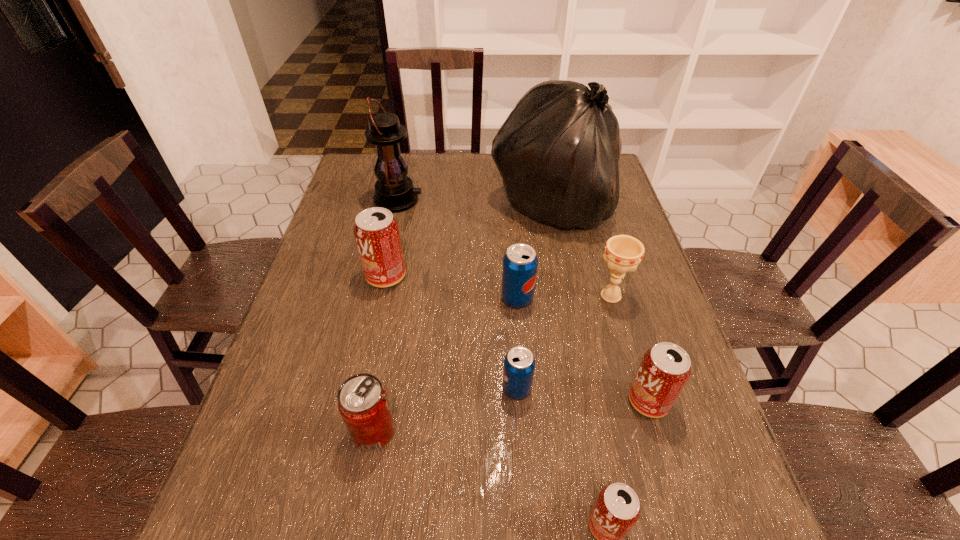
This screenshot has height=540, width=960. What are the coordinates of `unoccupied area between the chalice and the biggest red soda can` in the screenshot? It's located at (498, 286).

Identify the location of vacant space that's between the rightmost red soda can and the chalice. The height and width of the screenshot is (540, 960). (630, 348).

Locate an element on the screen. This screenshot has width=960, height=540. vacant area that lies between the bigger blue pop soda and the chalice is located at coordinates (564, 297).

You are a GUI agent. You are given a task and a screenshot of the screen. Output one action in this format:
    pyautogui.click(x=<x>, y=<y>)
    Task: Click on the free space that is in between the rightmost red soda can and the bigger blue pop soda
    
    Given the screenshot: What is the action you would take?
    pyautogui.click(x=583, y=349)

Find the location of a particular element. vacant area that lies between the rightmost soda can and the farther blue pop soda is located at coordinates (583, 349).

This screenshot has width=960, height=540. What are the coordinates of `empty space between the chalice and the tallest object` in the screenshot? It's located at (582, 250).

Locate which object is the closest to the bigger blue pop soda. Please provide its 2D coordinates. Your answer should be formatted as a tuple, i.e. [(x, y)], where the tuple contains the x and y coordinates of a point satisfying the conditions above.

[(623, 253)]

At what (x,y) coordinates should I click in order to perform the action: click on the fourth closest object to the farther blue pop soda. Please return your answer as a coordinate pair (x, y). This screenshot has width=960, height=540. Looking at the image, I should click on (376, 231).

Select which soda can appears as the fifth closest to the rightmost soda can. Please provide its 2D coordinates. Your answer should be formatted as a tuple, i.e. [(x, y)], where the tuple contains the x and y coordinates of a point satisfying the conditions above.

[(376, 231)]

Locate an element on the screen. The width and height of the screenshot is (960, 540). soda can that stands as the sixth closest to the chalice is located at coordinates (363, 403).